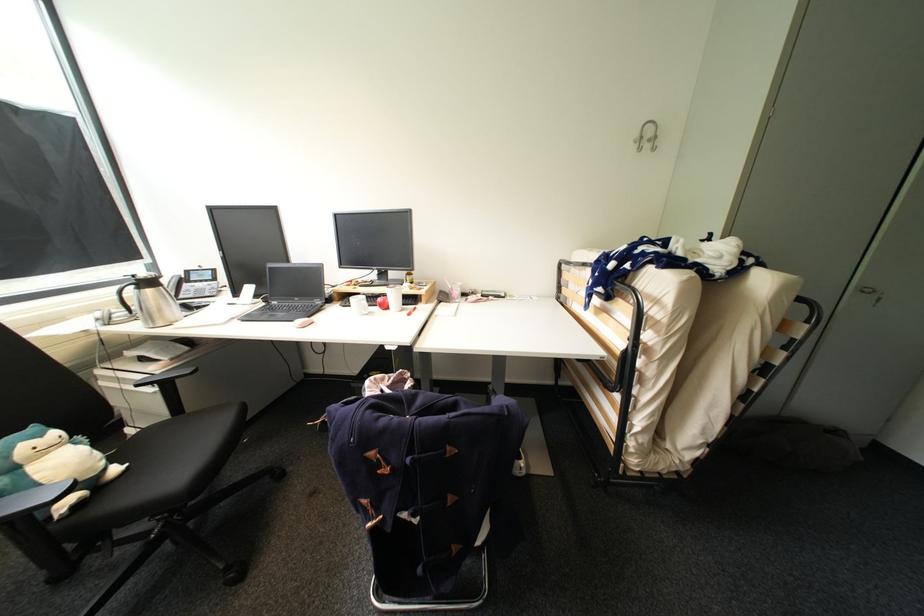
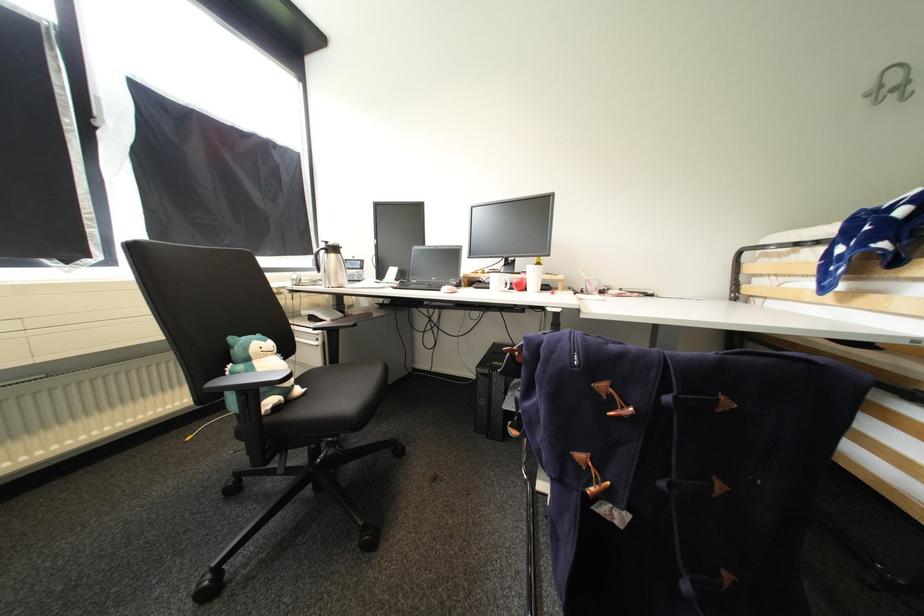
Question: The camera is either moving clockwise (left) or counter-clockwise (right) around the object. The first image is from the beginning of the video and the second image is from the end. Is the camera moving left or right when shooting the video?

Choices:
 (A) Left
 (B) Right

Answer: (B)